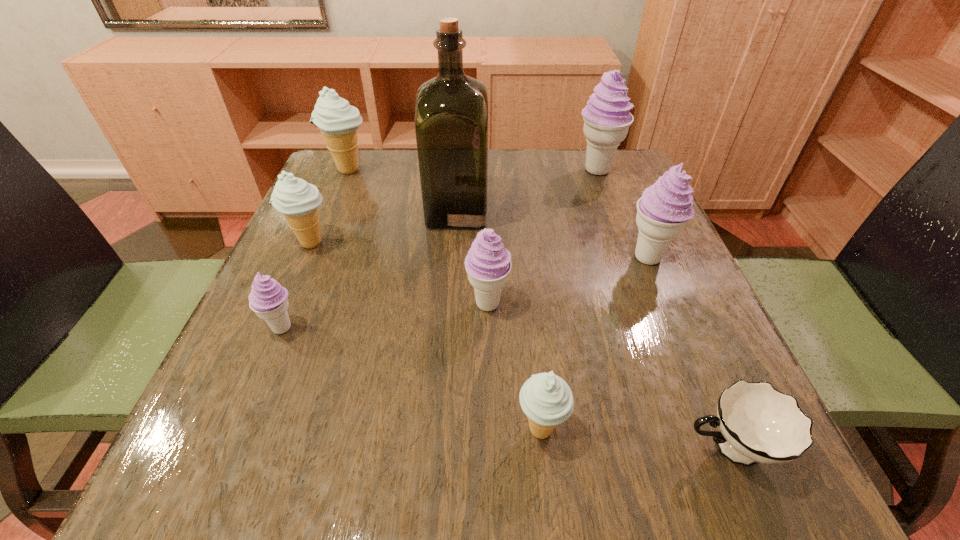
What are the coordinates of `the shortest object` in the screenshot? It's located at (758, 424).

The height and width of the screenshot is (540, 960). What are the coordinates of `cup` in the screenshot? It's located at (758, 424).

Identify the location of vacant region located 0.230m on the label of the liquor. click(x=588, y=210).

Find the location of a particular element. Image resolution: width=960 pixels, height=540 pixels. free region located 0.050m on the right of the eighth shortest object is located at coordinates (639, 170).

Image resolution: width=960 pixels, height=540 pixels. Identify the location of vacant space located 0.140m on the front of the biggest beige icecream. (329, 215).

What are the coordinates of `vacant space located on the back of the third smallest purple icecream` in the screenshot? It's located at (604, 151).

Locate an element on the screen. The width and height of the screenshot is (960, 540). vacant space located on the back of the second nearest beige icecream is located at coordinates (343, 170).

Where is `blank space located 0.160m on the front of the third purple icecream from right to left`? The height and width of the screenshot is (540, 960). blank space located 0.160m on the front of the third purple icecream from right to left is located at coordinates (489, 402).

Find the location of a particular element. The image size is (960, 540). vacant space located on the back of the smallest purple icecream is located at coordinates (312, 255).

Where is `vacant space positioned on the left of the smallest beige icecream`? The image size is (960, 540). vacant space positioned on the left of the smallest beige icecream is located at coordinates (424, 429).